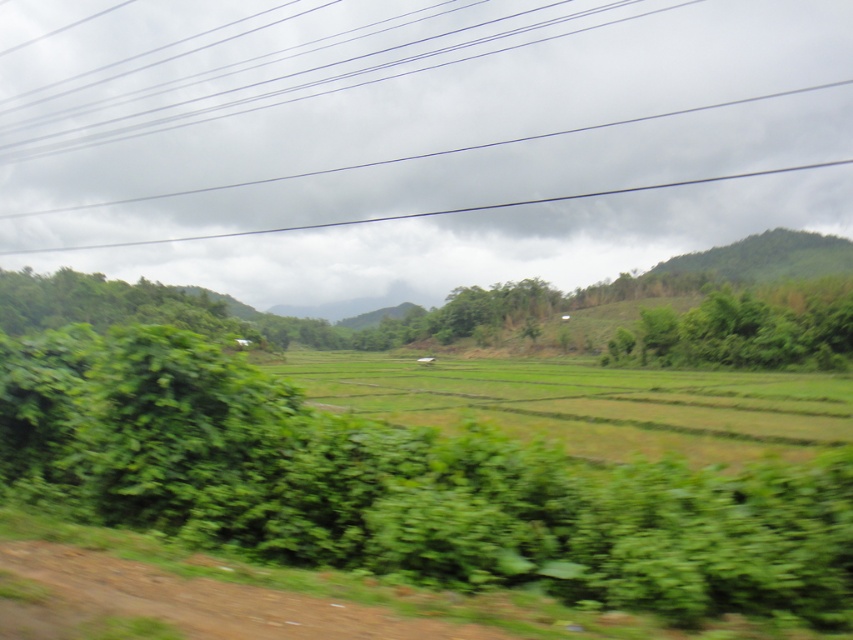
Question: Based on their relative distances, which object is farther from the green grassy field at center?

Choices:
 (A) black wire at upper center
 (B) green leafy tree at right

Answer: (A)

Question: Based on their relative distances, which object is farther from the green grassy field at center?

Choices:
 (A) green leafy tree at right
 (B) black wire at upper center

Answer: (B)

Question: Can you confirm if black wire at upper center is bigger than green leafy tree at right?

Choices:
 (A) no
 (B) yes

Answer: (B)

Question: Considering the relative positions of black wire at upper center and green grassy field at center in the image provided, where is black wire at upper center located with respect to green grassy field at center?

Choices:
 (A) right
 (B) left

Answer: (B)

Question: Does black wire at upper center have a larger size compared to green grassy field at center?

Choices:
 (A) yes
 (B) no

Answer: (A)

Question: Which of the following is the farthest from the observer?

Choices:
 (A) green leafy tree at right
 (B) green grassy field at center
 (C) black wire at upper center

Answer: (C)